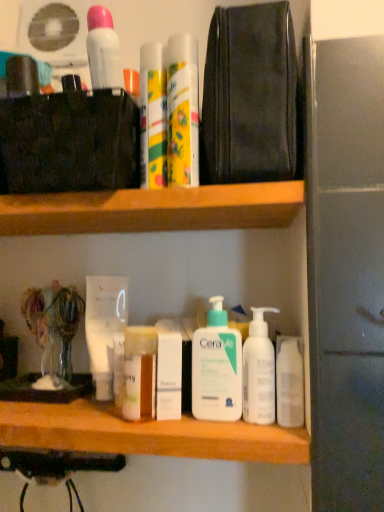
Find the location of `vacant space positioned to the left of white matte lotion at center, the first toiletry when ordered from bottom to top`. vacant space positioned to the left of white matte lotion at center, the first toiletry when ordered from bottom to top is located at coordinates (71, 412).